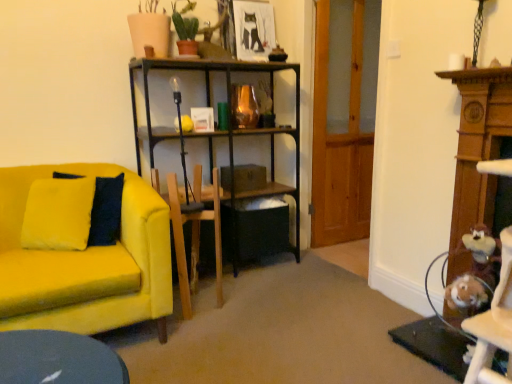
Question: Can you confirm if transparent wooden door at center is shorter than matte black picture frame at upper center?

Choices:
 (A) yes
 (B) no

Answer: (B)

Question: Would you say transparent wooden door at center contains matte black picture frame at upper center?

Choices:
 (A) yes
 (B) no

Answer: (B)

Question: Is transparent wooden door at center aimed at matte black picture frame at upper center?

Choices:
 (A) yes
 (B) no

Answer: (A)

Question: From the image's perspective, is transparent wooden door at center above matte black picture frame at upper center?

Choices:
 (A) yes
 (B) no

Answer: (B)

Question: Considering the relative sizes of transparent wooden door at center and matte black picture frame at upper center in the image provided, is transparent wooden door at center taller than matte black picture frame at upper center?

Choices:
 (A) no
 (B) yes

Answer: (B)

Question: Considering the relative sizes of transparent wooden door at center and matte black picture frame at upper center in the image provided, is transparent wooden door at center thinner than matte black picture frame at upper center?

Choices:
 (A) yes
 (B) no

Answer: (B)

Question: Is matte black picture frame at upper center smaller than velvet yellow couch at left?

Choices:
 (A) yes
 (B) no

Answer: (A)

Question: Considering the relative positions of matte black picture frame at upper center and velvet yellow couch at left in the image provided, is matte black picture frame at upper center behind velvet yellow couch at left?

Choices:
 (A) no
 (B) yes

Answer: (B)

Question: From the image's perspective, is matte black picture frame at upper center below velvet yellow couch at left?

Choices:
 (A) no
 (B) yes

Answer: (A)

Question: Could velvet yellow couch at left be considered to be inside matte black picture frame at upper center?

Choices:
 (A) no
 (B) yes

Answer: (A)

Question: From a real-world perspective, is matte black picture frame at upper center positioned over velvet yellow couch at left based on gravity?

Choices:
 (A) no
 (B) yes

Answer: (B)

Question: Is matte black picture frame at upper center positioned with its back to velvet yellow couch at left?

Choices:
 (A) yes
 (B) no

Answer: (B)

Question: Is transparent wooden door at center positioned with its back to velvet yellow couch at left?

Choices:
 (A) no
 (B) yes

Answer: (A)